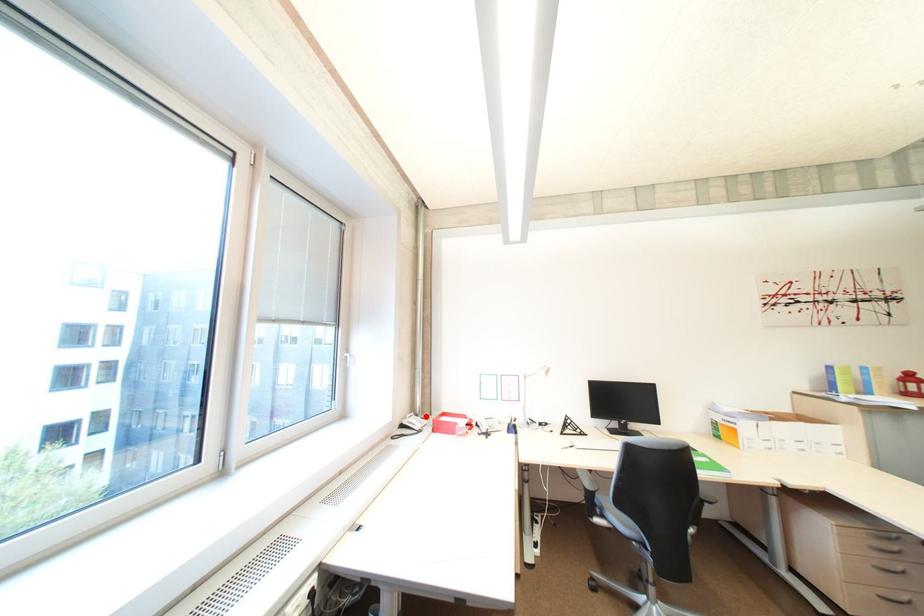
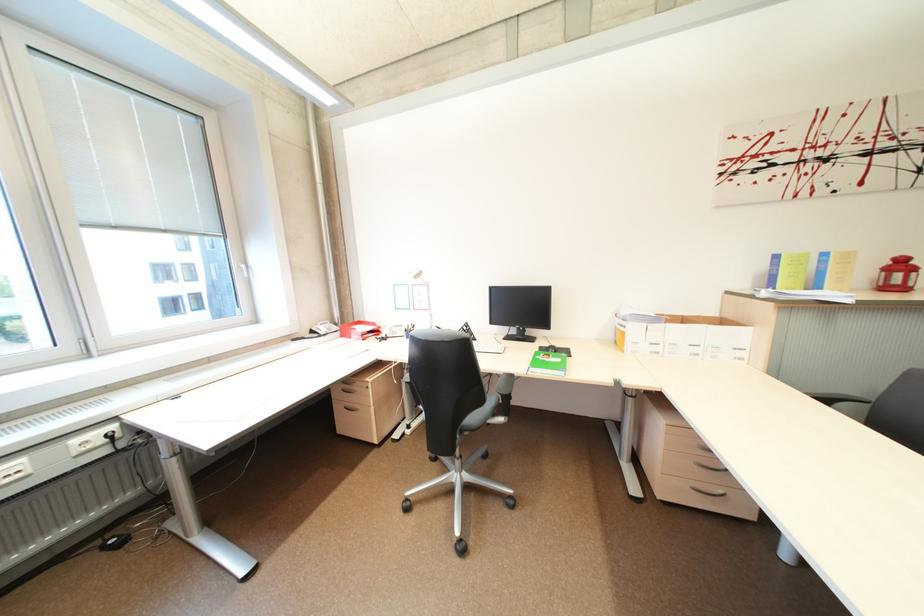
Question: I am providing you with two images of the same scene from different viewpoints. In image1, a red point is highlighted. Considering the same 3D point in image2, which of the following is correct?

Choices:
 (A) It is closer
 (B) It is farther

Answer: (A)